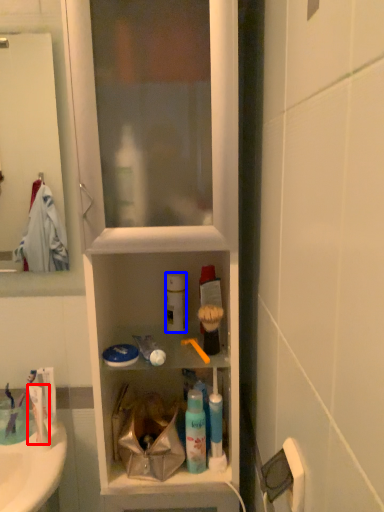
Question: Which object appears closest to the camera in this image, toothpaste (highlighted by a red box) or cleaning product (highlighted by a blue box)?

Choices:
 (A) toothpaste
 (B) cleaning product

Answer: (A)